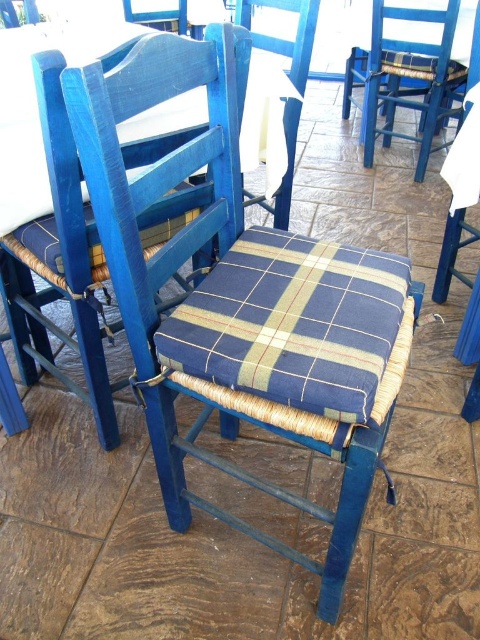
Can you confirm if blue plaid cushion at center is wider than blue woven wicker chair at center?

Correct, the width of blue plaid cushion at center exceeds that of blue woven wicker chair at center.

Between blue plaid cushion at center and blue woven wicker chair at center, which one is positioned lower?

Positioned lower is blue plaid cushion at center.

You are a GUI agent. You are given a task and a screenshot of the screen. Output one action in this format:
    pyautogui.click(x=<x>, y=<y>)
    Task: Click on the blue plaid cushion at center
    
    Given the screenshot: What is the action you would take?
    pyautogui.click(x=297, y=324)

What are the coordinates of `blue plaid cushion at center` in the screenshot? It's located at (297, 324).

Looking at this image, between blue plaid cushion at center and blue woven chair at upper right, which one appears on the right side from the viewer's perspective?

From the viewer's perspective, blue woven chair at upper right appears more on the right side.

Does point (313, 330) come in front of point (372, 33)?

That is True.

Who is more distant from viewer, [348,248] or [374,70]?

The point [374,70] is more distant.

Identify the location of blue plaid cushion at center. (297, 324).

Can you confirm if matte blue wood chair at center is positioned below blue woven chair at upper right?

Yes.

Is matte blue wood chair at center to the right of blue woven chair at upper right from the viewer's perspective?

No, matte blue wood chair at center is not to the right of blue woven chair at upper right.

Is point (184, 237) closer to camera compared to point (381, 96)?

That is True.

Locate an element on the screen. matte blue wood chair at center is located at coordinates click(108, 205).